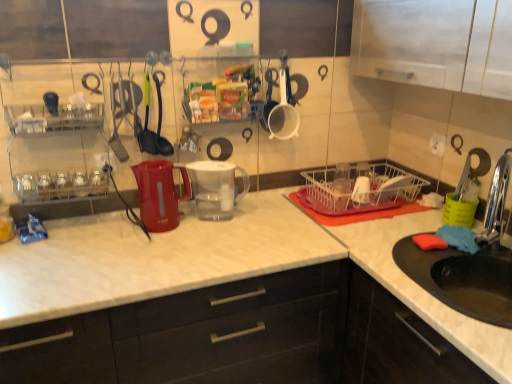
Where is `vacant space that is in between matte plastic kettle at center, the second appliance when ordered from right to left, and transparent plastic water filter pitcher at center, acting as the 1th appliance starting from the right`? The width and height of the screenshot is (512, 384). vacant space that is in between matte plastic kettle at center, the second appliance when ordered from right to left, and transparent plastic water filter pitcher at center, acting as the 1th appliance starting from the right is located at coordinates (200, 228).